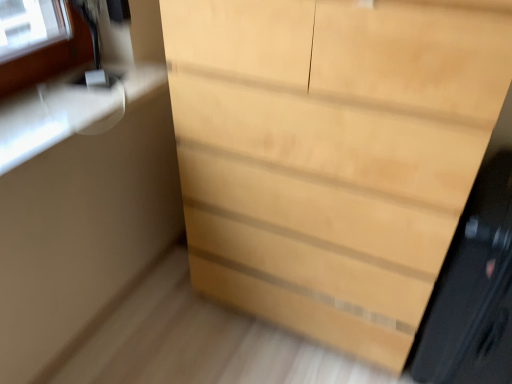
Measure the distance between point (510, 161) and camera.

A distance of 1.17 meters exists between point (510, 161) and camera.

What do you see at coordinates (473, 291) in the screenshot?
I see `black glossy screen door at right` at bounding box center [473, 291].

Locate an element on the screen. This screenshot has width=512, height=384. black glossy screen door at right is located at coordinates (473, 291).

Describe the element at coordinates (331, 154) in the screenshot. This screenshot has height=384, width=512. I see `light wood chest of drawers at center` at that location.

Identify the location of light wood chest of drawers at center. (331, 154).

What is the approximate width of light wood chest of drawers at center?

light wood chest of drawers at center is 19.07 inches wide.

Where is `black glossy screen door at right`? Image resolution: width=512 pixels, height=384 pixels. black glossy screen door at right is located at coordinates (473, 291).

Is light wood chest of drawers at center to the left or to the right of black glossy screen door at right in the image?

light wood chest of drawers at center is to the left of black glossy screen door at right.

Consider the image. Is the position of light wood chest of drawers at center more distant than that of black glossy screen door at right?

No, it is not.

Is point (426, 242) positioned before point (505, 352)?

That is False.

From the image's perspective, which one is positioned lower, light wood chest of drawers at center or black glossy screen door at right?

black glossy screen door at right is shown below in the image.

From a real-world perspective, which object stands above the other?

light wood chest of drawers at center, from a real-world perspective.

Can you confirm if light wood chest of drawers at center is wider than black glossy screen door at right?

No, light wood chest of drawers at center is not wider than black glossy screen door at right.

Between light wood chest of drawers at center and black glossy screen door at right, which one has more height?

Standing taller between the two is light wood chest of drawers at center.

From the picture: Considering the relative sizes of light wood chest of drawers at center and black glossy screen door at right in the image provided, is light wood chest of drawers at center bigger than black glossy screen door at right?

Indeed, light wood chest of drawers at center has a larger size compared to black glossy screen door at right.

Is light wood chest of drawers at center surrounding black glossy screen door at right?

No, black glossy screen door at right is not inside light wood chest of drawers at center.

Is there a large distance between light wood chest of drawers at center and black glossy screen door at right?

Actually, light wood chest of drawers at center and black glossy screen door at right are a little close together.

Is light wood chest of drawers at center positioned with its back to black glossy screen door at right?

No, light wood chest of drawers at center's orientation is not away from black glossy screen door at right.

How different are the orientations of light wood chest of drawers at center and black glossy screen door at right in degrees?

The angle between the facing direction of light wood chest of drawers at center and the facing direction of black glossy screen door at right is 0.688 degrees.

Locate an element on the screen. screen door on the right of light wood chest of drawers at center is located at coordinates (473, 291).

Which is more to the left, black glossy screen door at right or light wood chest of drawers at center?

light wood chest of drawers at center.

Is black glossy screen door at right further to the viewer compared to light wood chest of drawers at center?

Yes, black glossy screen door at right is further from the camera.

Does point (466, 320) appear closer or farther from the camera than point (199, 278)?

Point (466, 320).

From the picture: From the image's perspective, does black glossy screen door at right appear higher than light wood chest of drawers at center?

No, from the image's perspective, black glossy screen door at right is not on top of light wood chest of drawers at center.

From a real-world perspective, is black glossy screen door at right physically located above or below light wood chest of drawers at center?

black glossy screen door at right is situated lower than light wood chest of drawers at center in the real world.

Which of these two, black glossy screen door at right or light wood chest of drawers at center, is wider?

black glossy screen door at right is wider.

Is black glossy screen door at right taller or shorter than light wood chest of drawers at center?

Clearly, black glossy screen door at right is shorter compared to light wood chest of drawers at center.

Considering the relative sizes of black glossy screen door at right and light wood chest of drawers at center in the image provided, is black glossy screen door at right bigger than light wood chest of drawers at center?

No, black glossy screen door at right is not bigger than light wood chest of drawers at center.

Is black glossy screen door at right outside of light wood chest of drawers at center?

black glossy screen door at right lies outside light wood chest of drawers at center's area.

Is there a large distance between black glossy screen door at right and light wood chest of drawers at center?

Actually, black glossy screen door at right and light wood chest of drawers at center are a little close together.

Consider the image. Is black glossy screen door at right oriented away from light wood chest of drawers at center?

No, black glossy screen door at right is not facing away from light wood chest of drawers at center.

How different are the orientations of black glossy screen door at right and light wood chest of drawers at center in degrees?

0.688 degrees.

How far apart are black glossy screen door at right and light wood chest of drawers at center?

The distance of black glossy screen door at right from light wood chest of drawers at center is 33.65 centimeters.

Locate an element on the screen. chest of drawers above the black glossy screen door at right (from a real-world perspective) is located at coordinates (331, 154).

Image resolution: width=512 pixels, height=384 pixels. I want to click on screen door that appears below the light wood chest of drawers at center (from the image's perspective), so click(473, 291).

You are a GUI agent. You are given a task and a screenshot of the screen. Output one action in this format:
    pyautogui.click(x=<x>, y=<y>)
    Task: Click on the chest of drawers in front of the black glossy screen door at right
    Image resolution: width=512 pixels, height=384 pixels.
    Given the screenshot: What is the action you would take?
    pyautogui.click(x=331, y=154)